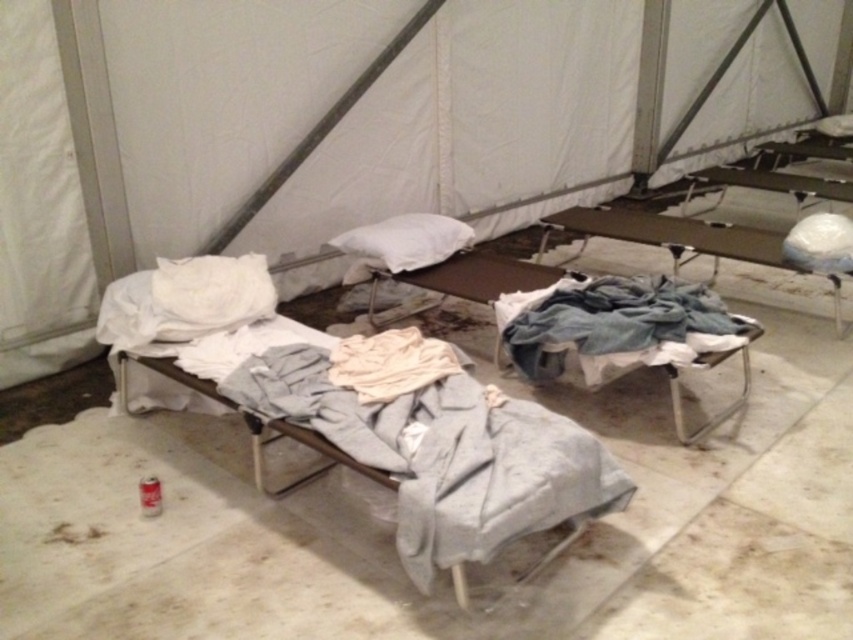
Is gray fabric bed frame at center bigger than white soft pillow at center?

Correct, gray fabric bed frame at center is larger in size than white soft pillow at center.

Can you confirm if gray fabric bed frame at center is positioned above white soft pillow at center?

No.

Which is behind, point (439, 401) or point (401, 218)?

The point (401, 218) is more distant.

The image size is (853, 640). Find the location of `gray fabric bed frame at center`. gray fabric bed frame at center is located at coordinates (419, 445).

Does gray fabric bed frame at center have a smaller size compared to metallic gray bed frame at center?

No.

Does gray fabric bed frame at center appear over metallic gray bed frame at center?

Incorrect, gray fabric bed frame at center is not positioned above metallic gray bed frame at center.

Is point (421, 445) farther from viewer compared to point (412, 282)?

No.

Where is `gray fabric bed frame at center`? The image size is (853, 640). gray fabric bed frame at center is located at coordinates (419, 445).

Between point (699, 360) and point (402, 250), which one is positioned behind?

Positioned behind is point (402, 250).

Does metallic gray bed frame at center appear under white soft pillow at center?

Yes.

The width and height of the screenshot is (853, 640). Identify the location of metallic gray bed frame at center. (469, 278).

This screenshot has height=640, width=853. Identify the location of metallic gray bed frame at center. (469, 278).